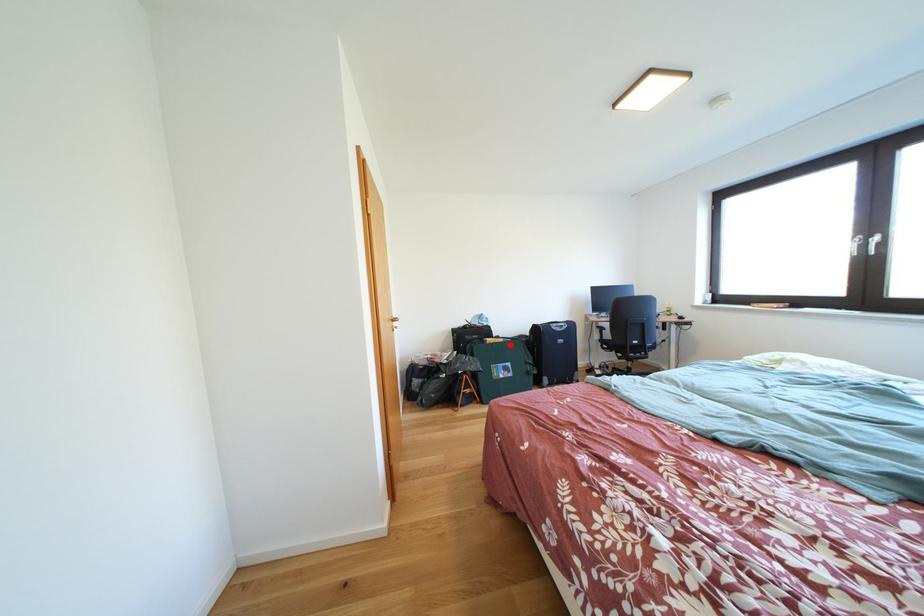
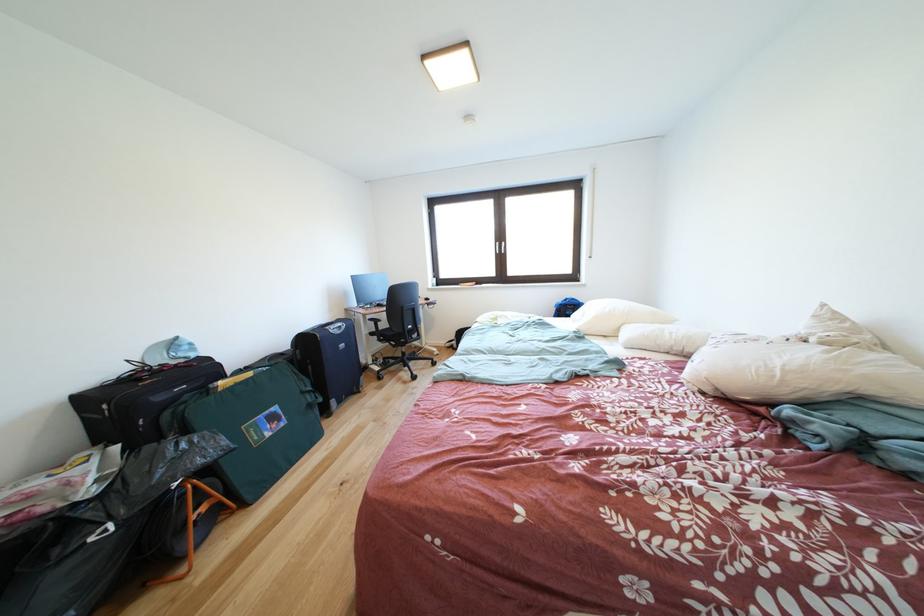
Question: I am providing you with two images of the same scene from different viewpoints. A red point is shown in image1. For the corresponding object point in image2, is it positioned nearer or farther from the camera?

Choices:
 (A) Nearer
 (B) Farther

Answer: (A)